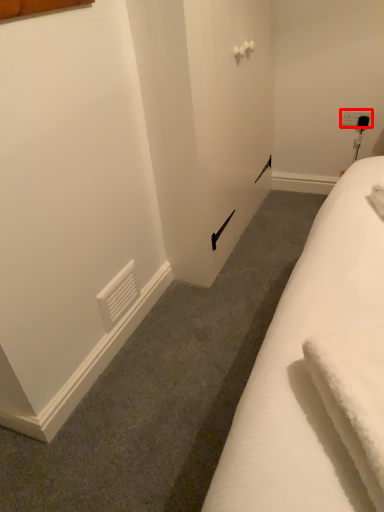
Question: From the image's perspective, considering the relative positions of electric outlet (annotated by the red box) and bath towel in the image provided, where is electric outlet (annotated by the red box) located with respect to the staircase?

Choices:
 (A) above
 (B) below

Answer: (A)